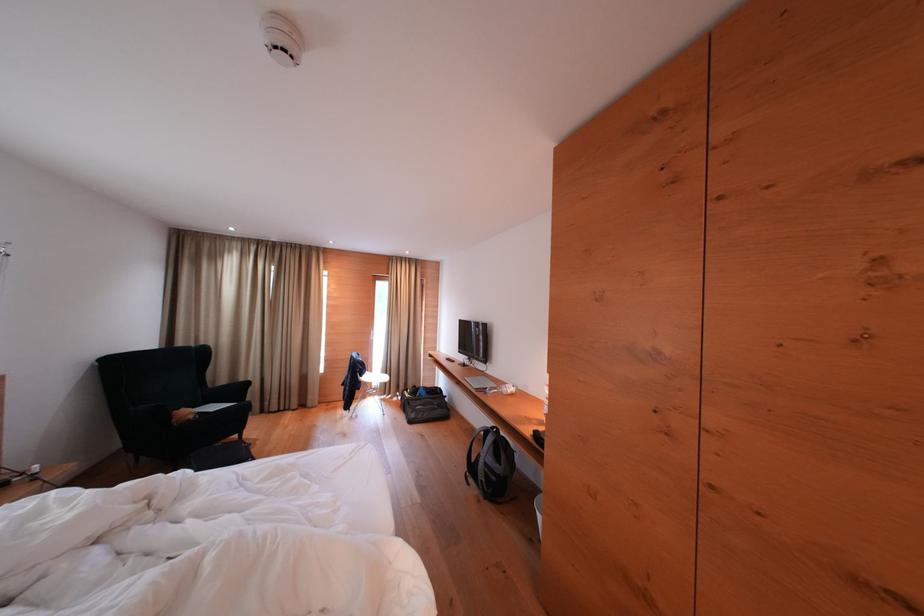
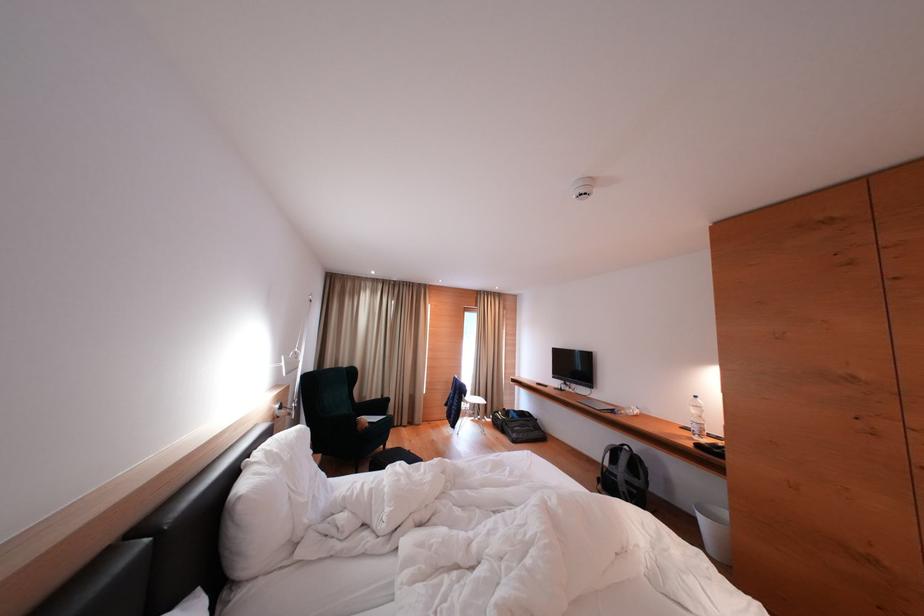
Locate, in the second image, the point that corresponds to point (383, 379) in the first image.

(477, 402)